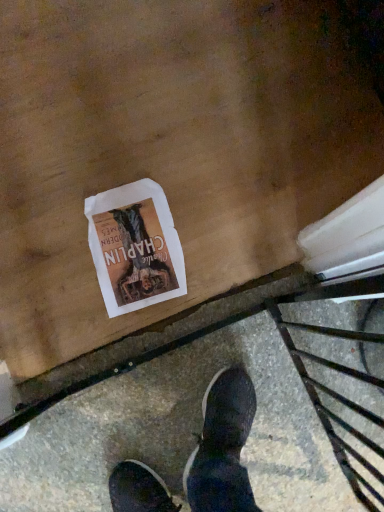
I want to click on free location above white paper flyer at center (from a real-world perspective), so 135,248.